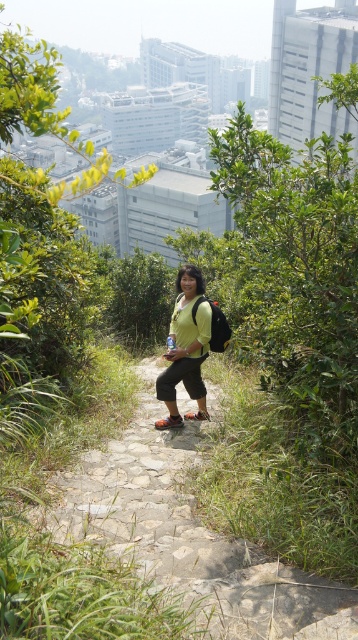
Is stone path at center thinner than matte green shirt at center?

Yes, stone path at center is thinner than matte green shirt at center.

Does stone path at center come behind matte green shirt at center?

No, it is not.

Where is `stone path at center`? The width and height of the screenshot is (358, 640). stone path at center is located at coordinates (187, 536).

I want to click on stone path at center, so click(187, 536).